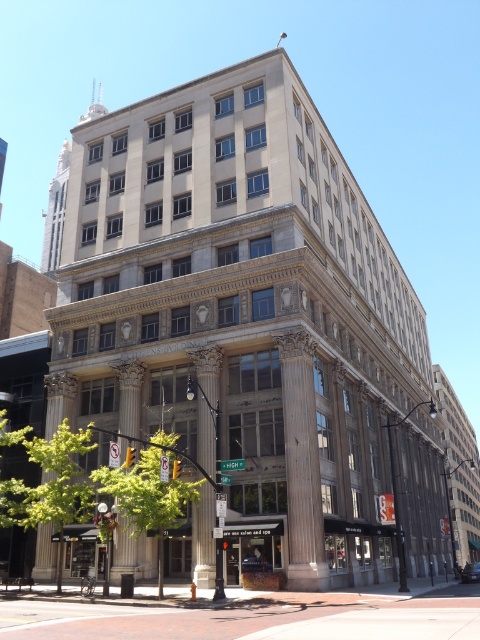
You are an architect inspecting the building facade. You notice two columns at the center of the building. One is labeled as smooth stone column at center and the other as polished stone column at center. Which of these columns has a greater width?

The polished stone column at center has a greater width than the smooth stone column at center.

You are standing in front of the building and want to take a photo. There are two points marked on the building facade. The first point is at coordinate point (x=214, y=566), and the second point is at coordinate point (x=126, y=560). Which point will appear larger in your photo?

Point (x=214, y=566) is closer to the camera than point (x=126, y=560), so it will appear larger in the photo.